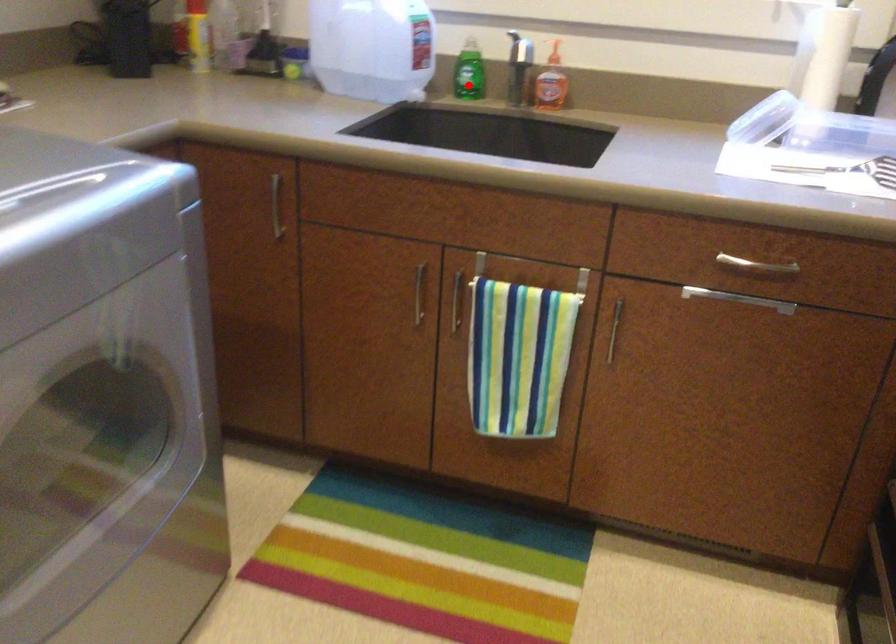
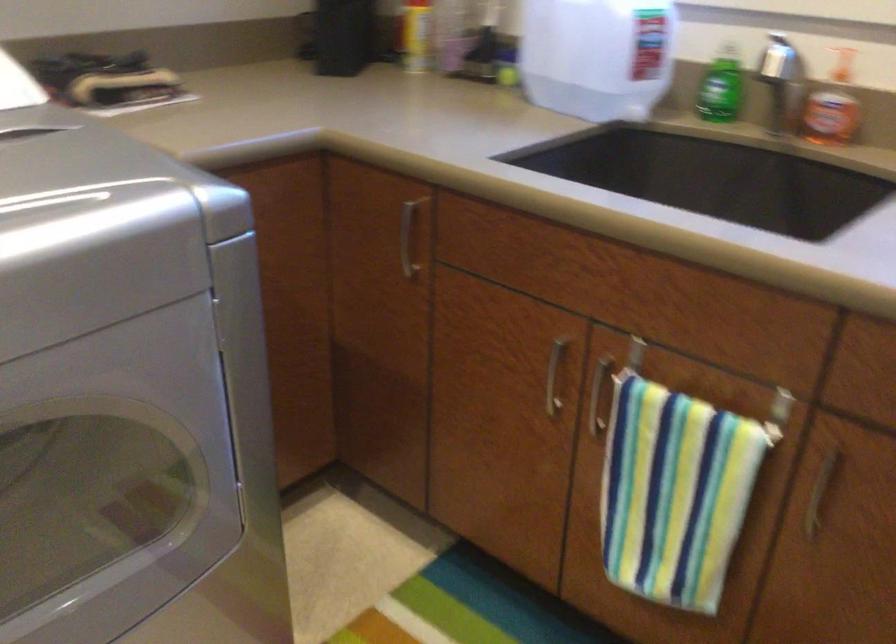
Question: I am providing you with two images of the same scene from different viewpoints. In image1, a red point is highlighted. Considering the same 3D point in image2, which of the following is correct?

Choices:
 (A) It is closer
 (B) It is farther

Answer: (A)